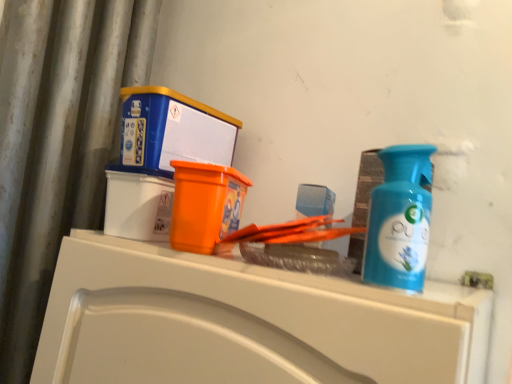
Question: Does blue plastic box at upper left have a smaller size compared to blue plastic bottle at right?

Choices:
 (A) no
 (B) yes

Answer: (A)

Question: From the image's perspective, would you say blue plastic box at upper left is positioned over blue plastic bottle at right?

Choices:
 (A) no
 (B) yes

Answer: (B)

Question: From a real-world perspective, is blue plastic box at upper left physically above blue plastic bottle at right?

Choices:
 (A) yes
 (B) no

Answer: (A)

Question: From the image's perspective, is blue plastic box at upper left below blue plastic bottle at right?

Choices:
 (A) yes
 (B) no

Answer: (B)

Question: Does blue plastic box at upper left come in front of blue plastic bottle at right?

Choices:
 (A) no
 (B) yes

Answer: (A)

Question: Is blue plastic box at upper left not inside blue plastic bottle at right?

Choices:
 (A) yes
 (B) no

Answer: (A)

Question: Would you say blue plastic bottle at right is a long distance from white glossy counter at upper center?

Choices:
 (A) no
 (B) yes

Answer: (A)

Question: Is blue plastic bottle at right bigger than white glossy counter at upper center?

Choices:
 (A) yes
 (B) no

Answer: (B)

Question: From a real-world perspective, is blue plastic bottle at right on white glossy counter at upper center?

Choices:
 (A) yes
 (B) no

Answer: (A)

Question: Is blue plastic bottle at right behind white glossy counter at upper center?

Choices:
 (A) yes
 (B) no

Answer: (A)

Question: Is blue plastic bottle at right thinner than white glossy counter at upper center?

Choices:
 (A) yes
 (B) no

Answer: (A)

Question: Considering the relative positions of blue plastic bottle at right and white glossy counter at upper center in the image provided, is blue plastic bottle at right to the right of white glossy counter at upper center from the viewer's perspective?

Choices:
 (A) no
 (B) yes

Answer: (B)

Question: Considering the relative positions of blue plastic bottle at right and blue plastic box at upper left in the image provided, is blue plastic bottle at right to the right of blue plastic box at upper left from the viewer's perspective?

Choices:
 (A) no
 (B) yes

Answer: (B)